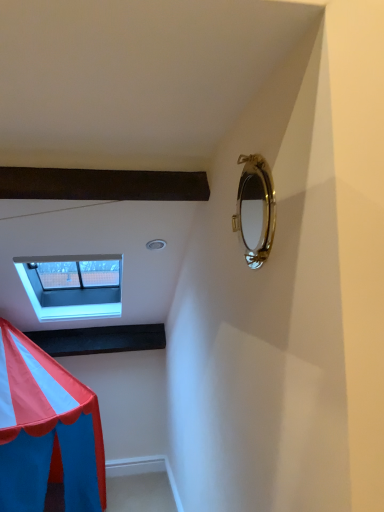
Question: Considering the relative sizes of white plastic window at upper left and gold metallic mirror at upper right in the image provided, is white plastic window at upper left smaller than gold metallic mirror at upper right?

Choices:
 (A) no
 (B) yes

Answer: (A)

Question: Does white plastic window at upper left come in front of gold metallic mirror at upper right?

Choices:
 (A) yes
 (B) no

Answer: (B)

Question: Is white plastic window at upper left next to gold metallic mirror at upper right and touching it?

Choices:
 (A) yes
 (B) no

Answer: (B)

Question: Can we say white plastic window at upper left lies outside gold metallic mirror at upper right?

Choices:
 (A) no
 (B) yes

Answer: (B)

Question: Does white plastic window at upper left lie behind gold metallic mirror at upper right?

Choices:
 (A) no
 (B) yes

Answer: (B)

Question: Can you confirm if white plastic window at upper left is positioned to the left of gold metallic mirror at upper right?

Choices:
 (A) no
 (B) yes

Answer: (B)

Question: Does gold metallic mirror at upper right have a larger size compared to white plastic window at upper left?

Choices:
 (A) no
 (B) yes

Answer: (A)

Question: Considering the relative sizes of gold metallic mirror at upper right and white plastic window at upper left in the image provided, is gold metallic mirror at upper right smaller than white plastic window at upper left?

Choices:
 (A) no
 (B) yes

Answer: (B)

Question: Can you confirm if gold metallic mirror at upper right is taller than white plastic window at upper left?

Choices:
 (A) no
 (B) yes

Answer: (A)

Question: From the image's perspective, is gold metallic mirror at upper right above white plastic window at upper left?

Choices:
 (A) no
 (B) yes

Answer: (B)

Question: Is gold metallic mirror at upper right looking in the opposite direction of white plastic window at upper left?

Choices:
 (A) yes
 (B) no

Answer: (B)

Question: Is white plastic window at upper left a part of gold metallic mirror at upper right?

Choices:
 (A) yes
 (B) no

Answer: (B)

Question: Is gold metallic mirror at upper right wider or thinner than white plastic window at upper left?

Choices:
 (A) thin
 (B) wide

Answer: (A)